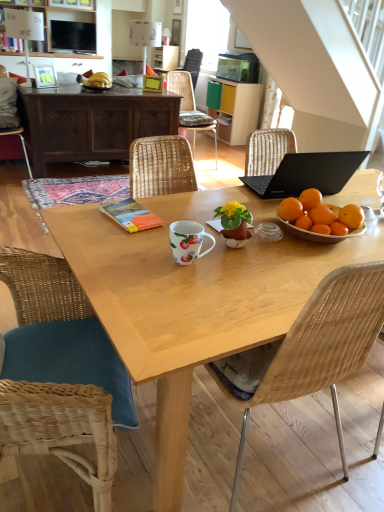
At what (x,y) coordinates should I click in order to perform the action: click on vacant region to the left of porcelain floral mug at center. Please return your answer as a coordinate pair (x, y). Image resolution: width=384 pixels, height=512 pixels. Looking at the image, I should click on (136, 254).